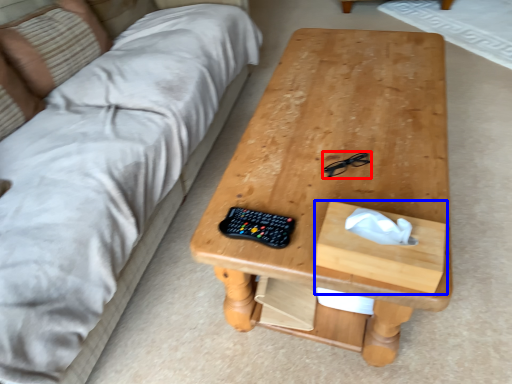
Question: Which of the following is the closest to the observer, glasses (highlighted by a red box) or drawer (highlighted by a blue box)?

Choices:
 (A) glasses
 (B) drawer

Answer: (B)